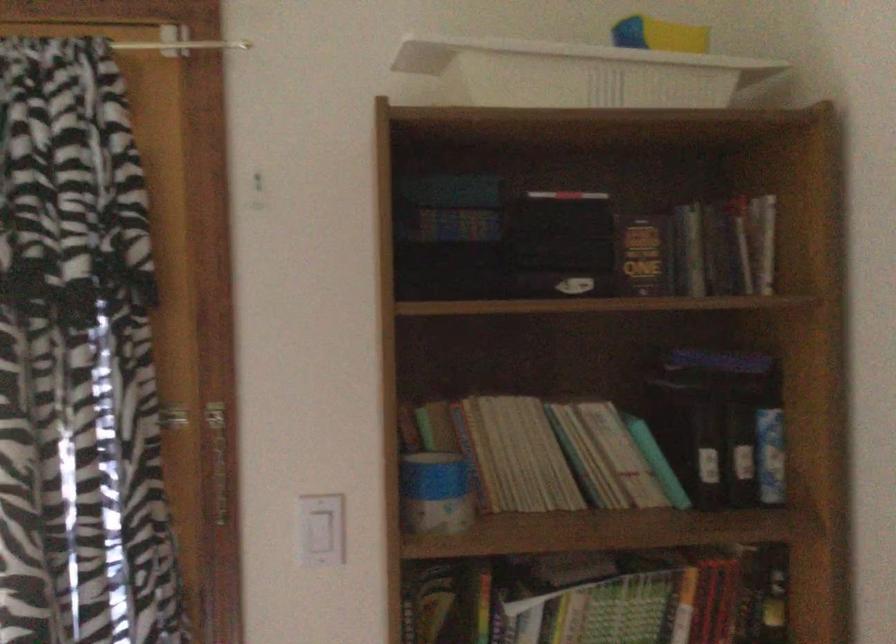
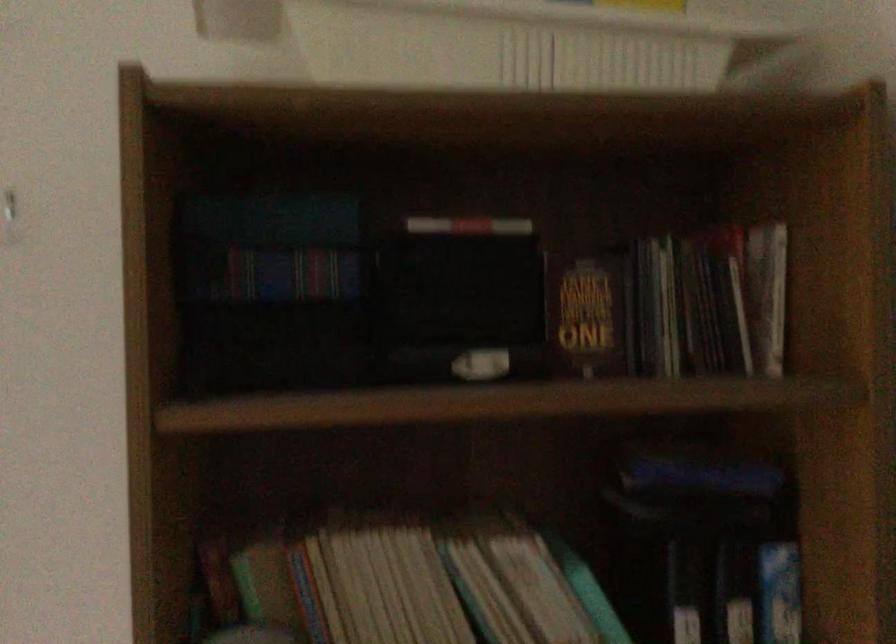
Question: The images are taken continuously from a first-person perspective. In which direction are you moving?

Choices:
 (A) Left
 (B) Right
 (C) Forward
 (D) Backward

Answer: (C)